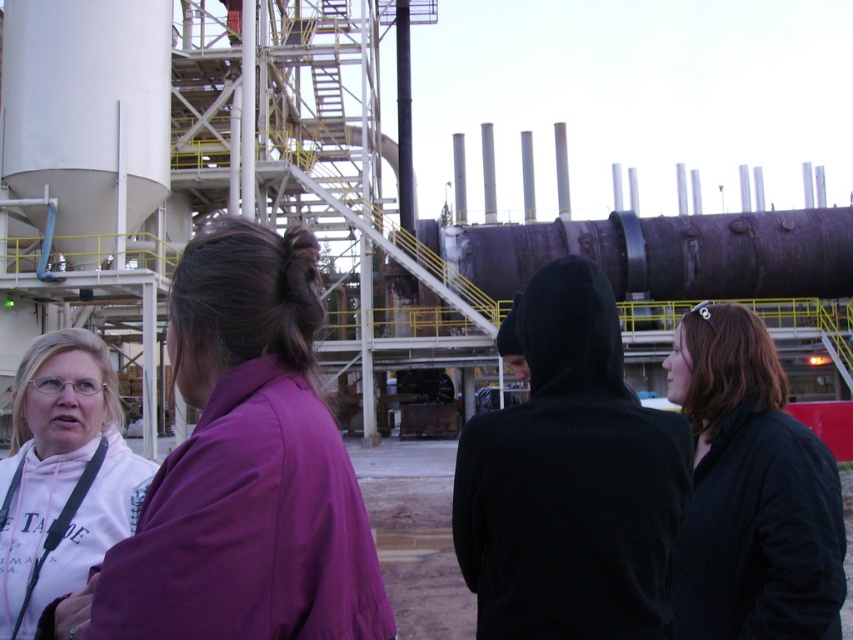
You are a security guard at the industrial facility. You need to identify which person is taller between the purple fabric shirt at left and the white cotton hoodie at lower left. Based on the scene, which one is taller?

The purple fabric shirt at left is taller than the white cotton hoodie at lower left according to the description.